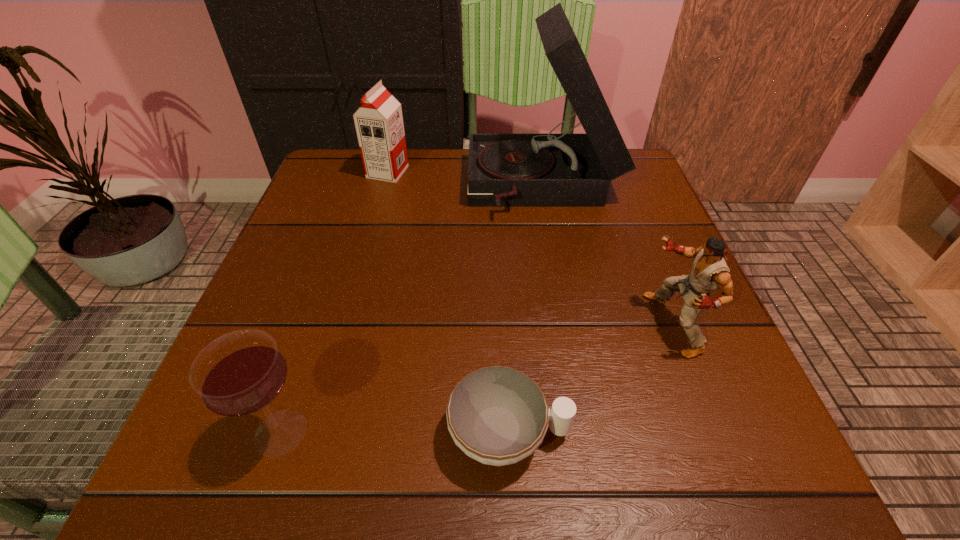
Locate an element on the screen. phonograph_record is located at coordinates (505, 170).

Image resolution: width=960 pixels, height=540 pixels. Identify the location of soya milk. (379, 125).

You are a GUI agent. You are given a task and a screenshot of the screen. Output one action in this format:
    pyautogui.click(x=<x>, y=<y>)
    Task: Click on the puncher
    
    Given the screenshot: What is the action you would take?
    pyautogui.click(x=710, y=272)

The image size is (960, 540). Find the location of `wineglass`. wineglass is located at coordinates (241, 373).

Where is `chinaware`? chinaware is located at coordinates (496, 415).

Locate an element on the screen. free space located 0.370m on the front-facing side of the phonograph_record is located at coordinates (310, 187).

Locate an element on the screen. free point located 0.350m on the front-facing side of the phonograph_record is located at coordinates (319, 187).

This screenshot has height=540, width=960. Identify the location of blank area located on the front-facing side of the phonograph_record. (324, 187).

This screenshot has width=960, height=540. What are the coordinates of `vacant space located 0.160m on the front of the soya milk` in the screenshot? It's located at (373, 225).

The image size is (960, 540). Identify the location of blank space located 0.070m on the front-facing side of the third nearest object. (607, 324).